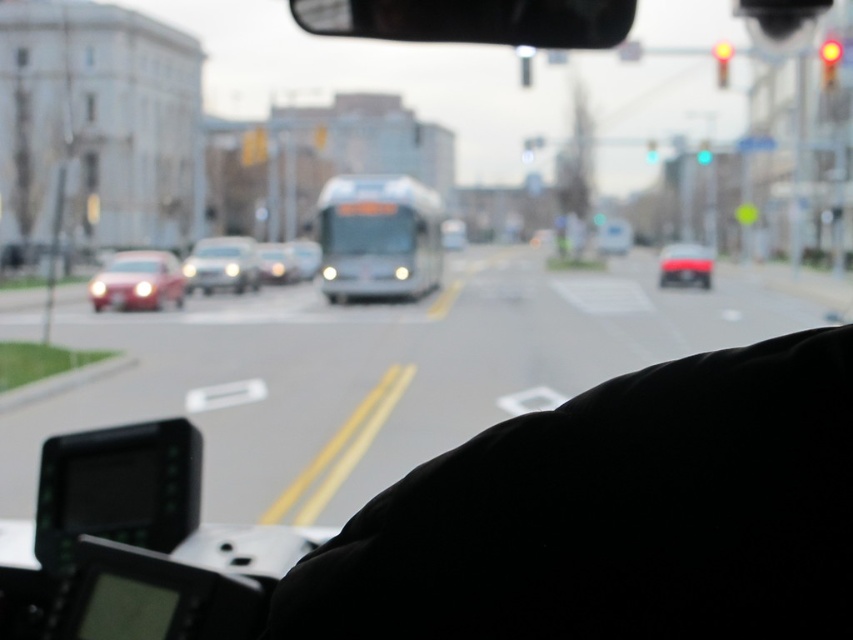
Question: Which object is farther from the camera taking this photo?

Choices:
 (A) matte silver sedan at center
 (B) transparent glass bus at center
 (C) red glass traffic light at upper right
 (D) black fabric at lower right

Answer: (A)

Question: Among these objects, which one is nearest to the camera?

Choices:
 (A) transparent glass bus at center
 (B) red glass traffic light at upper center

Answer: (A)

Question: Is transparent glass bus at center closer to the viewer compared to matte silver sedan at center?

Choices:
 (A) no
 (B) yes

Answer: (B)

Question: Is matte silver sedan at center to the right of red glass traffic light at upper right from the viewer's perspective?

Choices:
 (A) no
 (B) yes

Answer: (A)

Question: Which of the following is the farthest from the observer?

Choices:
 (A) metallic silver bus at center
 (B) satin silver sedan at center
 (C) red glass traffic light at upper right

Answer: (B)

Question: Is black fabric at lower right to the left of yellow glass traffic light at upper right from the viewer's perspective?

Choices:
 (A) yes
 (B) no

Answer: (A)